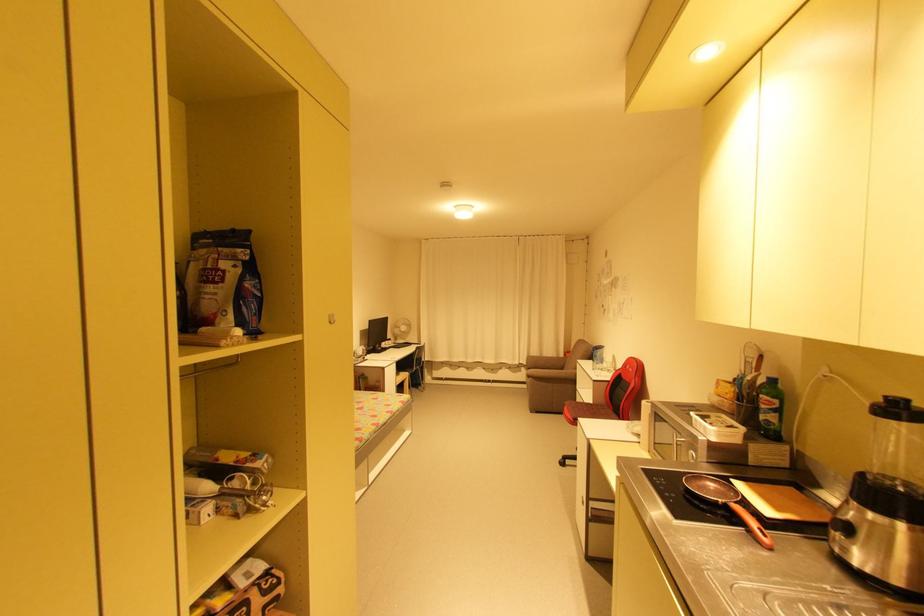
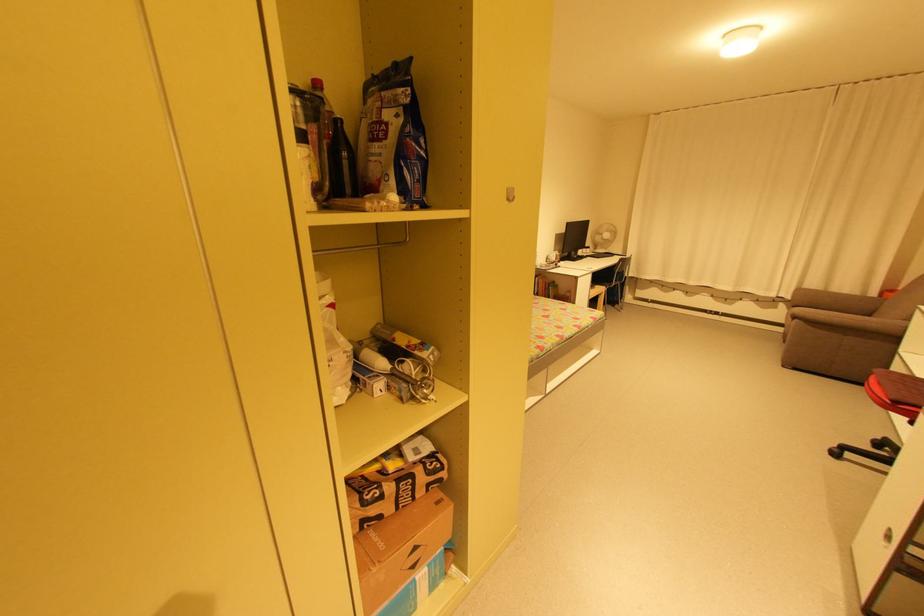
Where in the second image is the point corresponding to pixel 334 323 from the first image?

(513, 200)